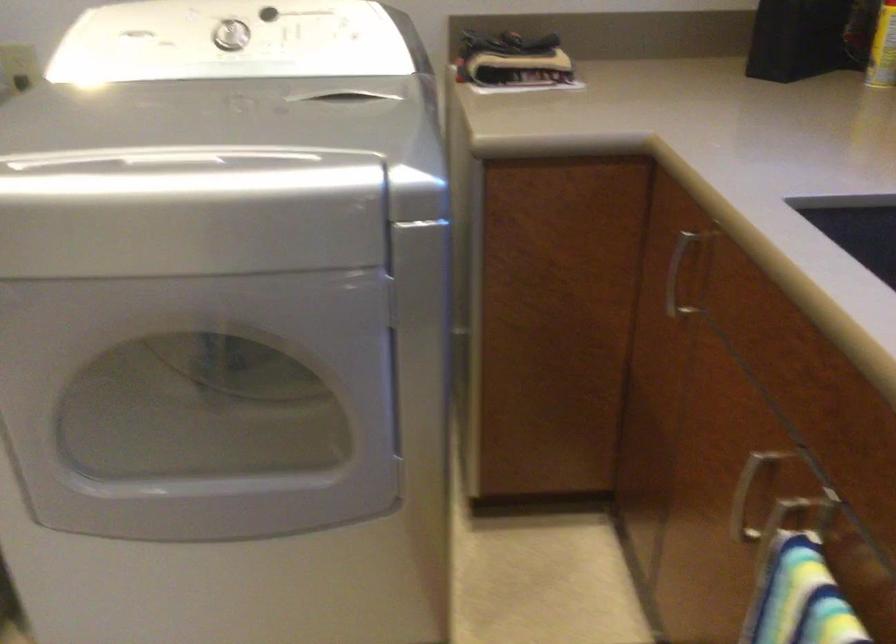
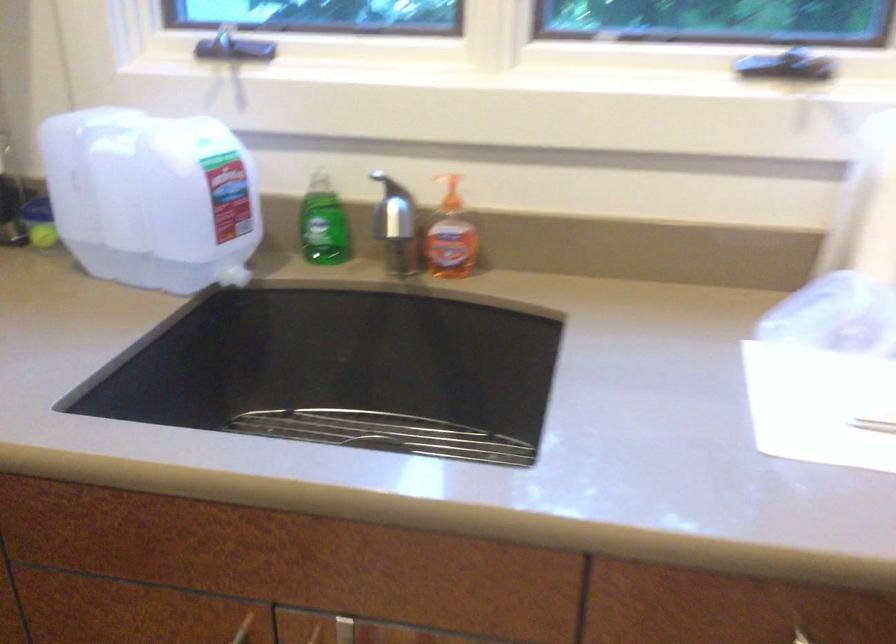
Locate, in the second image, the point that corresponds to pixel 780 458 in the first image.

(243, 629)